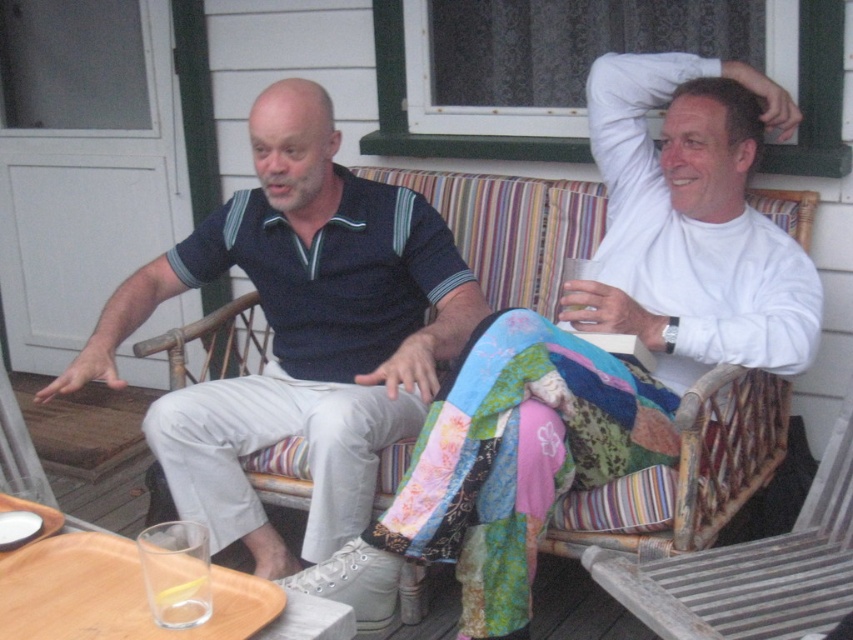
Question: Can you confirm if dark blue polo shirt at center is smaller than wooden slats rocking chair at lower right?

Choices:
 (A) yes
 (B) no

Answer: (B)

Question: Can you confirm if dark blue polo shirt at center is thinner than wooden slats rocking chair at lower right?

Choices:
 (A) no
 (B) yes

Answer: (A)

Question: Among these objects, which one is farthest from the camera?

Choices:
 (A) dark blue polo shirt at center
 (B) wooden slats rocking chair at lower right

Answer: (A)

Question: Which of the following is the closest to the observer?

Choices:
 (A) dark blue polo shirt at center
 (B) wooden slats rocking chair at lower right

Answer: (B)

Question: Among these points, which one is nearest to the camera?

Choices:
 (A) (225, 381)
 (B) (757, 636)

Answer: (B)

Question: Is dark blue polo shirt at center behind wooden slats rocking chair at lower right?

Choices:
 (A) yes
 (B) no

Answer: (A)